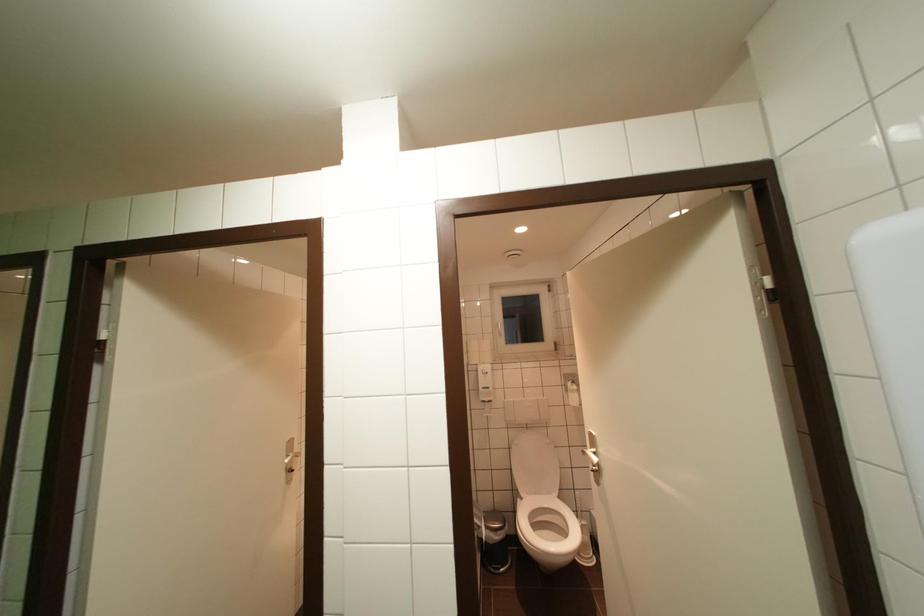
The width and height of the screenshot is (924, 616). What do you see at coordinates (484, 391) in the screenshot?
I see `the wall dispenser lever` at bounding box center [484, 391].